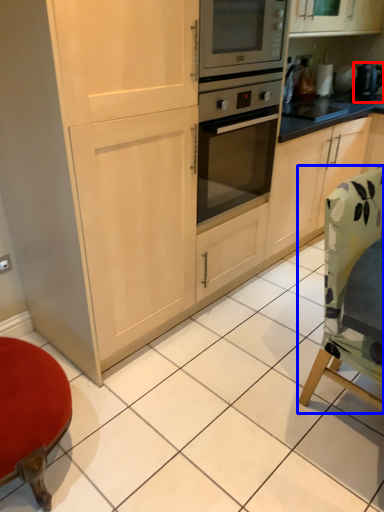
Question: Among these objects, which one is farthest to the camera, appliance (highlighted by a red box) or chair (highlighted by a blue box)?

Choices:
 (A) appliance
 (B) chair

Answer: (A)